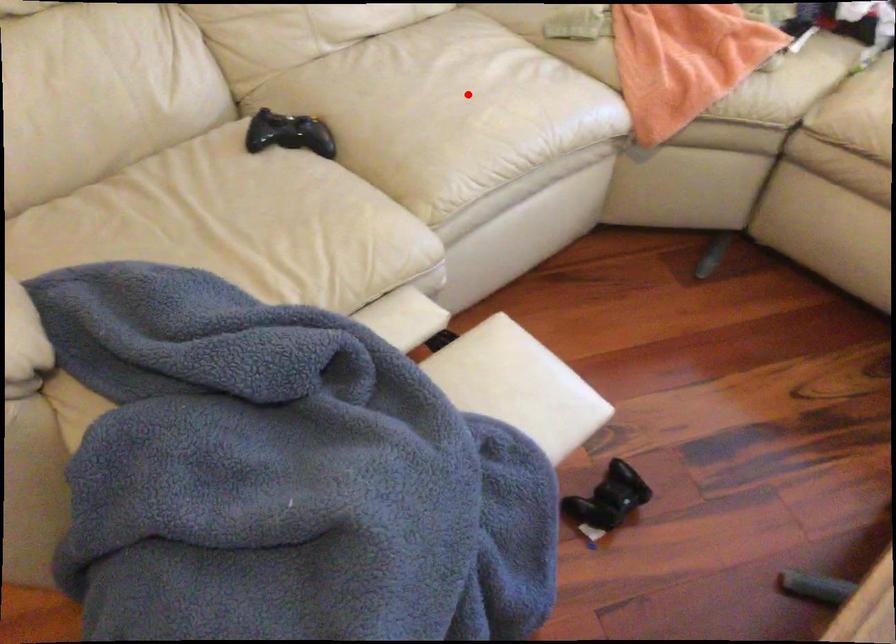
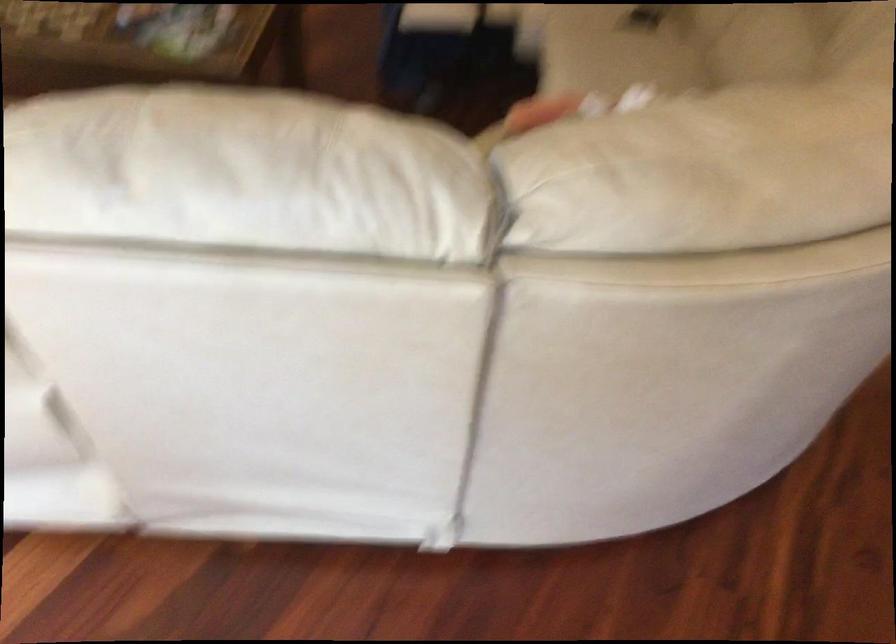
Question: I am providing you with two images of the same scene from different viewpoints. Given a red point in image1, look at the same physical point in image2. Is it:

Choices:
 (A) Closer to the viewpoint
 (B) Farther from the viewpoint

Answer: (B)